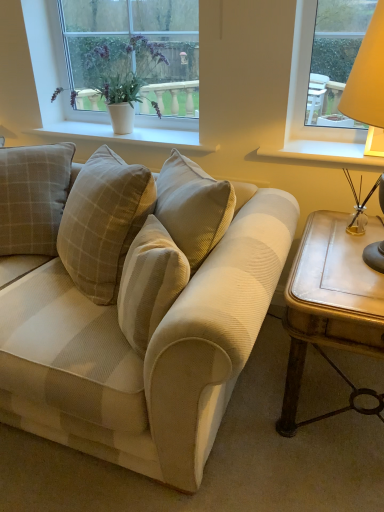
This screenshot has width=384, height=512. Find the location of `vacant space situated above white painted wood at right, the 1th window sill viewed from the right (from a real-world perspective)`. vacant space situated above white painted wood at right, the 1th window sill viewed from the right (from a real-world perspective) is located at coordinates (322, 146).